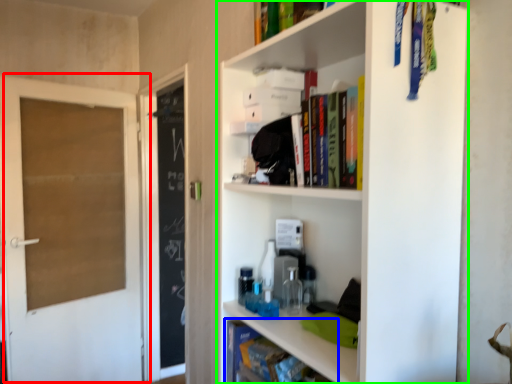
Question: Based on their relative distances, which object is farther from door (highlighted by a red box)? Choose from book (highlighted by a blue box) and shelf (highlighted by a green box).

Choices:
 (A) book
 (B) shelf

Answer: (B)